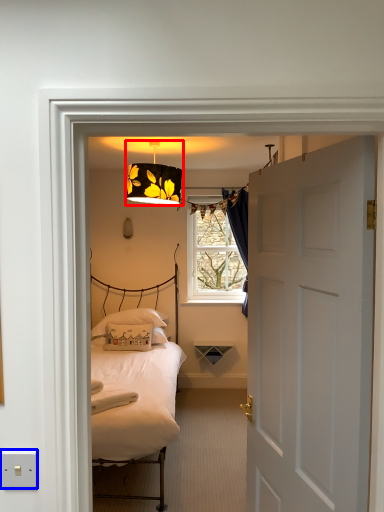
Question: Among these objects, which one is nearest to the camera, lamp (highlighted by a red box) or electric outlet (highlighted by a blue box)?

Choices:
 (A) lamp
 (B) electric outlet

Answer: (B)